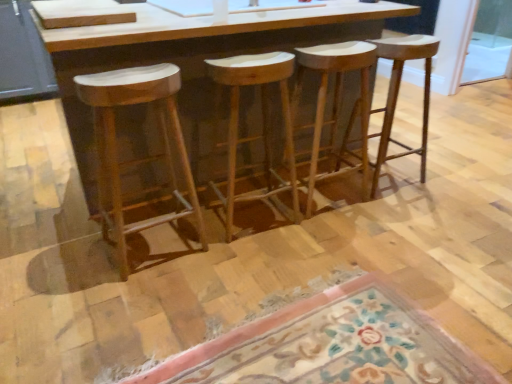
Identify the location of free space underneath natural wood stool at center, the fourth stool viewed from the left (from a real-world perspective). (388, 180).